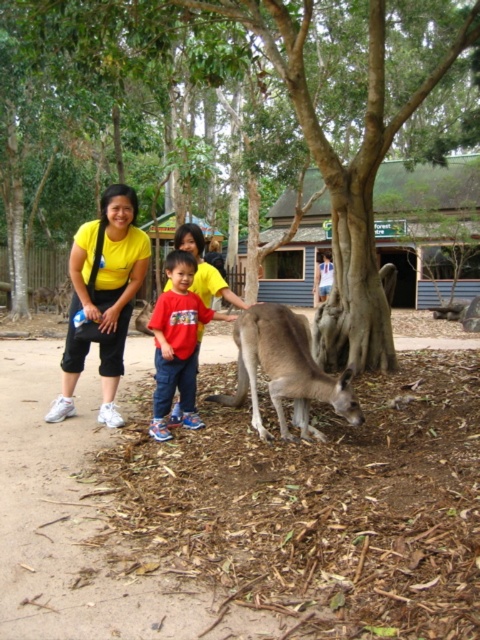
You are a photographer trying to capture the kangaroo in the center of the image. There is a brown textured tree at center marked by point (247, 115). Where should you position yourself to ensure the kangaroo is centered in your photo?

To center the kangaroo in your photo, position yourself directly in line with the point (247, 115) where the brown textured tree at center is marked, as this point indicates the central area of the image where the kangaroo is located.

You are a photographer standing at the center of the scene. You want to take a photo that includes both the brown textured tree at center and the red cotton shirt at center. Given that your camera has a maximum zoom range of 10 meters, will you be able to capture both subjects in a single frame without moving?

The distance between the brown textured tree at center and the red cotton shirt at center is 12.82 meters. Since your camera can only zoom up to 10 meters, you won t be able to capture both subjects in a single frame without moving closer or adjusting your position.